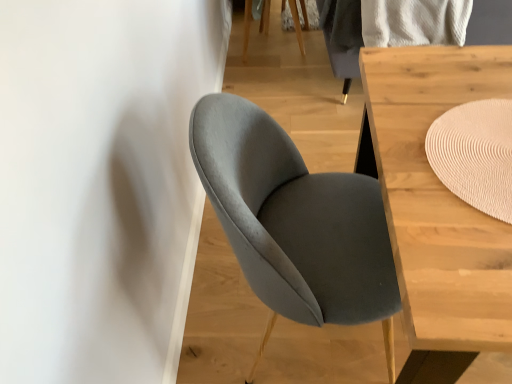
Question: From the image's perspective, relative to light wood table at center, is beige woven mat at upper right above or below?

Choices:
 (A) above
 (B) below

Answer: (A)

Question: Considering the relative positions of beige woven mat at upper right and light wood table at center in the image provided, is beige woven mat at upper right to the left or to the right of light wood table at center?

Choices:
 (A) left
 (B) right

Answer: (A)

Question: Which object is positioned closest to the beige woven mat at upper right?

Choices:
 (A) suede gray chair at center
 (B) light wood table at center

Answer: (B)

Question: Based on their relative distances, which object is nearer to the suede gray chair at center?

Choices:
 (A) light wood table at center
 (B) beige woven mat at upper right

Answer: (A)